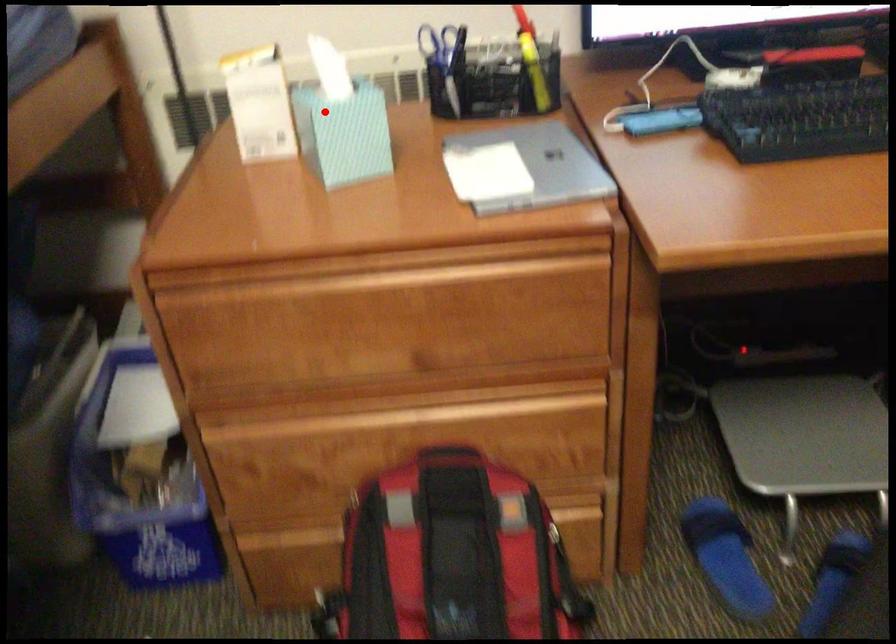
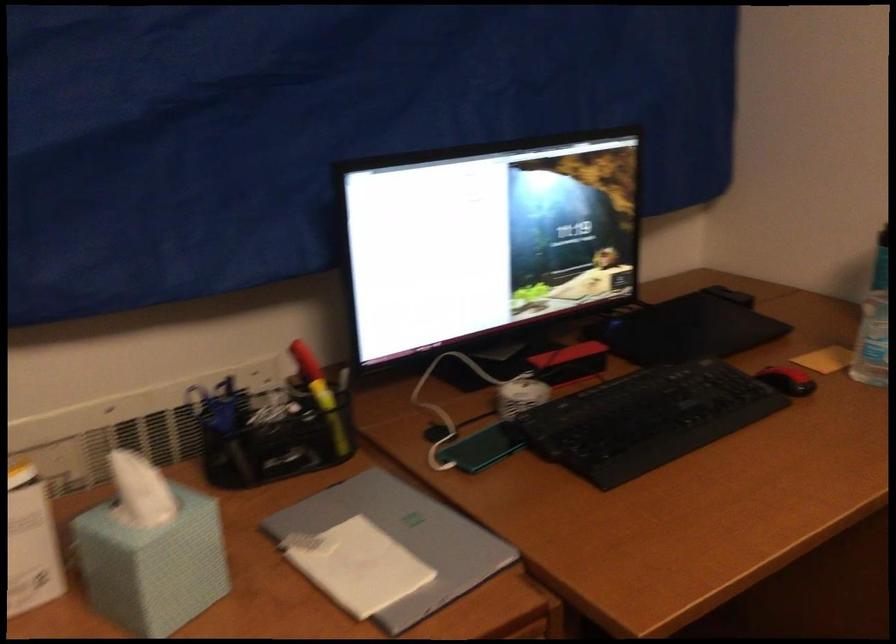
Question: I am providing you with two images of the same scene from different viewpoints. A red point is shown in image1. For the corresponding object point in image2, is it positioned nearer or farther from the camera?

Choices:
 (A) Nearer
 (B) Farther

Answer: (A)